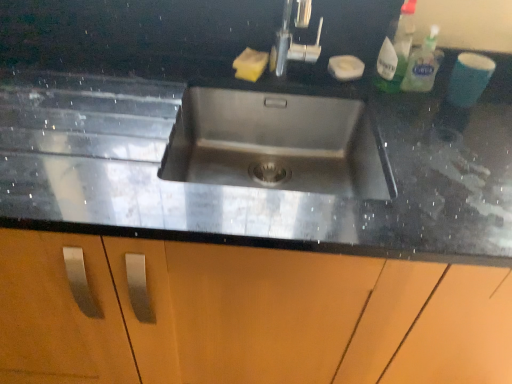
Where is `vacant area that lies to the right of translucent plastic spray bottle at upper right, acting as the 2th cleaning product starting from the right`? The width and height of the screenshot is (512, 384). vacant area that lies to the right of translucent plastic spray bottle at upper right, acting as the 2th cleaning product starting from the right is located at coordinates (455, 107).